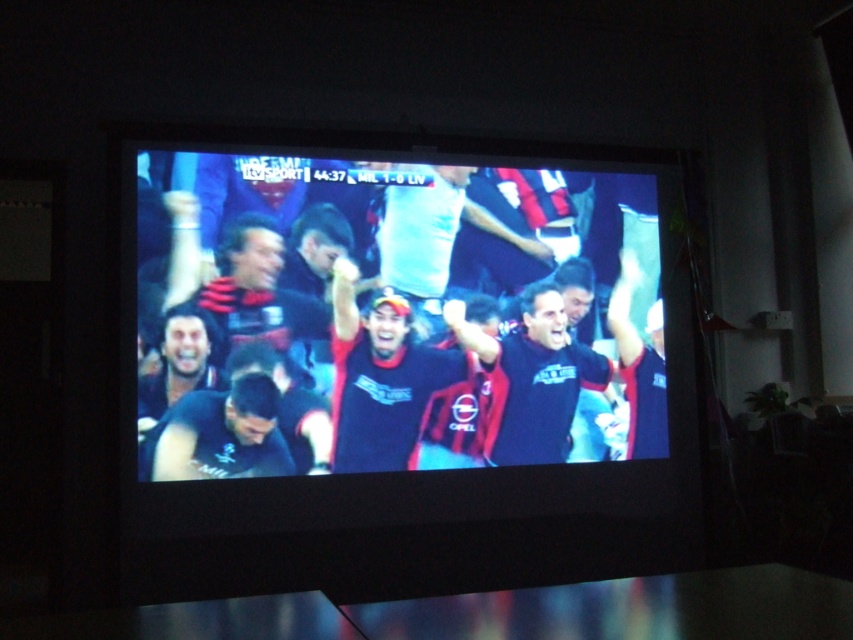
You are a sports analyst watching the TV screen. You notice two players on the screen wearing a dark blue jersey at center and a matte black shirt at lower left. Which player is wearing a jersey that is wider in the torso area?

The dark blue jersey at center might be wider than matte black shirt at lower left, so the player wearing the dark blue jersey at center has a wider torso area.

You are trying to place a matte black shirt on the stand next to the black matte television at center. The stand can only hold items that are narrower than the television. Can the matte black shirt at lower left fit on the stand?

The black matte television at center might be wider than matte black shirt at lower left, so there is a possibility that the matte black shirt at lower left can fit on the stand if the television is indeed wider.

You are standing in a room with a television. You want to place a small decorative item exactly at the center of the black matte television at center. According to the coordinates provided, is the point at (403, 369) the correct location for the center?

Yes, the point at (403, 369) corresponds to the black matte television at center, so placing the item there would be accurate.